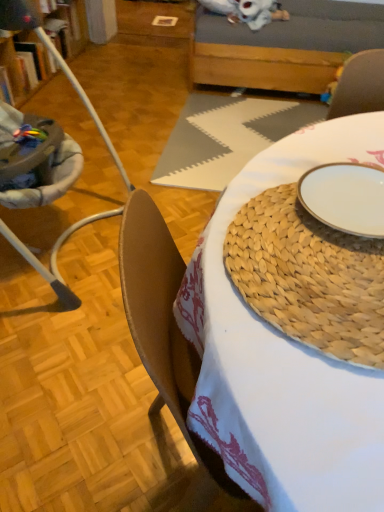
Question: Could you tell me if white ceramic plate at center is turned towards woven mat at center?

Choices:
 (A) yes
 (B) no

Answer: (A)

Question: From the image's perspective, is white ceramic plate at center over woven mat at center?

Choices:
 (A) no
 (B) yes

Answer: (B)

Question: Is white ceramic plate at center turned away from woven mat at center?

Choices:
 (A) yes
 (B) no

Answer: (A)

Question: From a real-world perspective, is white ceramic plate at center physically below woven mat at center?

Choices:
 (A) no
 (B) yes

Answer: (A)

Question: Can we say white ceramic plate at center lies outside woven mat at center?

Choices:
 (A) yes
 (B) no

Answer: (B)

Question: Considering the relative sizes of white ceramic plate at center and woven mat at center in the image provided, is white ceramic plate at center bigger than woven mat at center?

Choices:
 (A) yes
 (B) no

Answer: (B)

Question: Can you confirm if wooden couch at upper center is taller than velvet-like gray armchair at upper right?

Choices:
 (A) no
 (B) yes

Answer: (B)

Question: Can you confirm if wooden couch at upper center is thinner than velvet-like gray armchair at upper right?

Choices:
 (A) yes
 (B) no

Answer: (B)

Question: Is wooden couch at upper center closer to the viewer compared to velvet-like gray armchair at upper right?

Choices:
 (A) yes
 (B) no

Answer: (A)

Question: Is wooden couch at upper center not within velvet-like gray armchair at upper right?

Choices:
 (A) yes
 (B) no

Answer: (A)

Question: From a real-world perspective, does wooden couch at upper center sit lower than velvet-like gray armchair at upper right?

Choices:
 (A) yes
 (B) no

Answer: (B)

Question: Is wooden couch at upper center further to the viewer compared to velvet-like gray armchair at upper right?

Choices:
 (A) yes
 (B) no

Answer: (B)

Question: Is velvet-like gray armchair at upper right beside wooden couch at upper center?

Choices:
 (A) no
 (B) yes

Answer: (A)